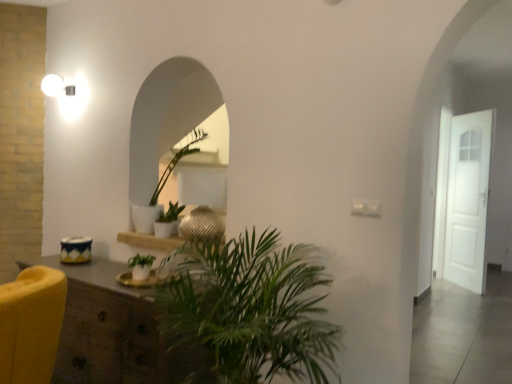
Question: Considering the relative sizes of wooden cabinet at lower left and wooden shelf at center in the image provided, is wooden cabinet at lower left smaller than wooden shelf at center?

Choices:
 (A) no
 (B) yes

Answer: (A)

Question: Is wooden cabinet at lower left facing towards wooden shelf at center?

Choices:
 (A) no
 (B) yes

Answer: (A)

Question: From the image's perspective, would you say wooden cabinet at lower left is shown under wooden shelf at center?

Choices:
 (A) no
 (B) yes

Answer: (B)

Question: Considering the relative sizes of wooden cabinet at lower left and wooden shelf at center in the image provided, is wooden cabinet at lower left shorter than wooden shelf at center?

Choices:
 (A) yes
 (B) no

Answer: (B)

Question: Is wooden cabinet at lower left not near wooden shelf at center?

Choices:
 (A) yes
 (B) no

Answer: (B)

Question: Is point (481, 144) closer or farther from the camera than point (143, 274)?

Choices:
 (A) closer
 (B) farther

Answer: (B)

Question: From the image's perspective, is white matte door at right located above or below green matte plant at center, which ranks as the second houseplant in top-to-bottom order?

Choices:
 (A) above
 (B) below

Answer: (A)

Question: Is white matte door at right inside the boundaries of green matte plant at center, which ranks as the second houseplant in top-to-bottom order, or outside?

Choices:
 (A) outside
 (B) inside

Answer: (A)

Question: Is white matte door at right taller or shorter than green matte plant at center, which ranks as the second houseplant in top-to-bottom order?

Choices:
 (A) short
 (B) tall

Answer: (B)

Question: Considering the positions of green matte plant at center, the second houseplant ordered from the bottom, and wooden cabinet at lower left in the image, is green matte plant at center, the second houseplant ordered from the bottom, bigger or smaller than wooden cabinet at lower left?

Choices:
 (A) small
 (B) big

Answer: (A)

Question: Is point pyautogui.click(x=134, y=266) closer or farther from the camera than point pyautogui.click(x=130, y=311)?

Choices:
 (A) closer
 (B) farther

Answer: (B)

Question: Looking at their shapes, would you say green matte plant at center, which is the 2th houseplant in back-to-front order, is wider or thinner than wooden cabinet at lower left?

Choices:
 (A) wide
 (B) thin

Answer: (B)

Question: From the image's perspective, is green matte plant at center, the second houseplant ordered from the bottom, above or below wooden cabinet at lower left?

Choices:
 (A) above
 (B) below

Answer: (A)

Question: From the image's perspective, is green matte plant at center, the 3th houseplant from the front, above or below wooden shelf at center?

Choices:
 (A) above
 (B) below

Answer: (A)

Question: Visually, is green matte plant at center, which is the 3th houseplant in bottom-to-top order, positioned to the left or to the right of wooden shelf at center?

Choices:
 (A) left
 (B) right

Answer: (A)